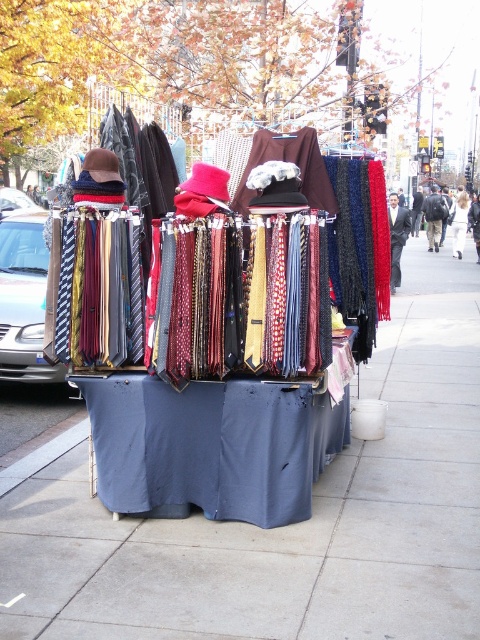
You are a delivery person who needs to place a large box on the ground at the market stall. The box is 10 cm tall. Can you place it on the smooth concrete pavement at center without it being blocked by the black leather backpack at center?

The smooth concrete pavement at center is not as tall as the black leather backpack at center, so the box can be placed on the pavement without obstruction from the backpack.

You are a delivery person trying to park your bike. You see the smooth concrete pavement at center and the gray concrete curb at lower left. Which surface is better for parking your bike?

The smooth concrete pavement at center is closer to the viewer than the gray concrete curb at lower left, so it would be better to park your bike on the smooth concrete pavement at center as it is more accessible.

You are a delivery person who needs to place a large box on the ground. The box is 1.2 meters tall. You see the smooth concrete pavement at center and the gray concrete curb at lower left. Which surface can you place the box on without it being unstable?

The smooth concrete pavement at center is much taller than the gray concrete curb at lower left, so placing the box on the smooth concrete pavement at center would provide a more stable surface since it has a larger base area to support the box.